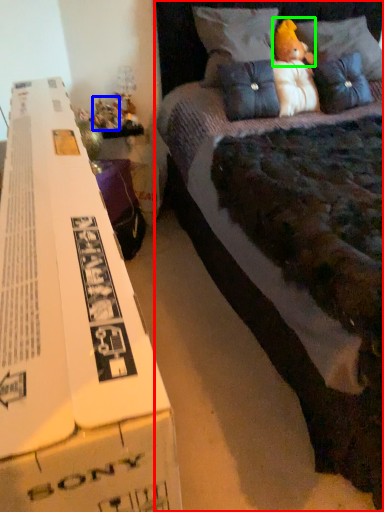
Question: Which object is the farthest from bed (highlighted by a red box)? Choose among these: toy (highlighted by a blue box) or toy (highlighted by a green box).

Choices:
 (A) toy
 (B) toy

Answer: (A)